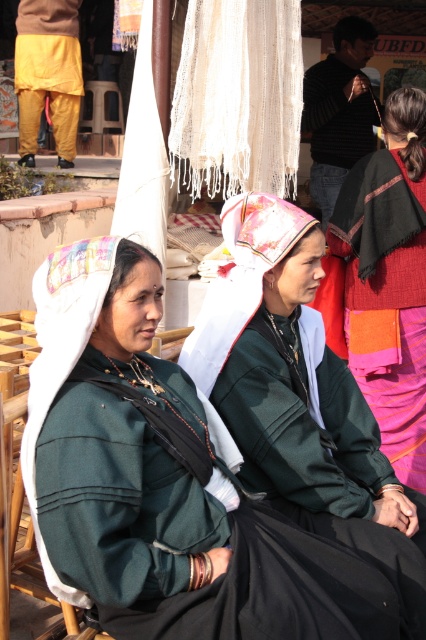
You are taking a photo of two women in traditional attire. You want to focus on the woman closer to the camera. Which point should you use for focusing? The options are point 1 at point (x=89, y=524) and point 2 at point (x=285, y=170).

Point 1 at point (x=89, y=524) is closer to the camera, so you should use that point for focusing to ensure the woman closer to the camera is in focus.

You are a tailor who needs to determine which item requires more fabric to make between the green fabric headscarf at center and the yellow cotton pants at left. Based on the image, which one would need more fabric?

The green fabric headscarf at center is bigger than the yellow cotton pants at left, so it would require more fabric to make.

You are a photographer standing at the entrance of a market. You see a woman wearing a green fabric headscarf at center. To capture her headscarf clearly in your photo, you need to be within 2 meters. Should you move closer or stay where you are?

The green fabric headscarf at center is 2.70 meters from the camera, so you need to move closer to be within 2 meters to capture it clearly.